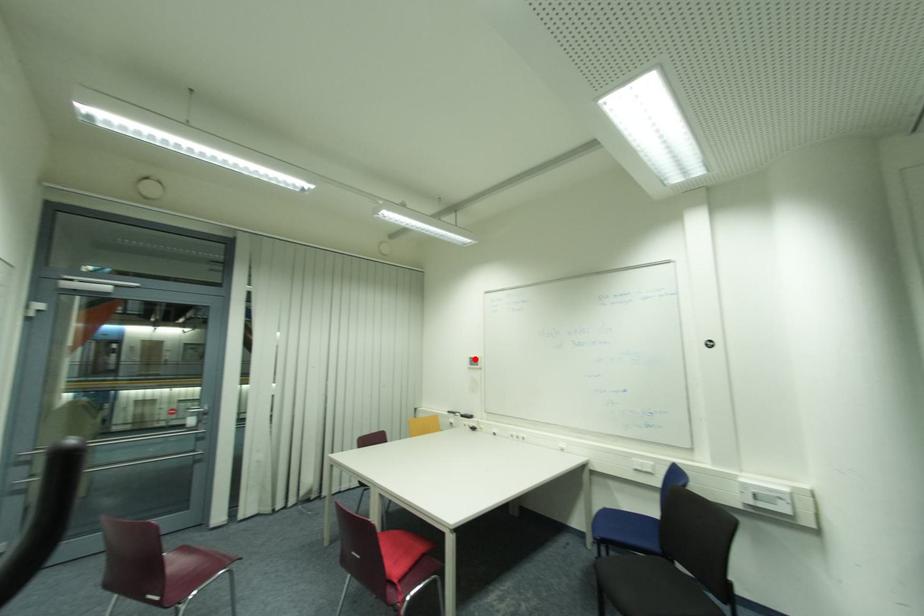
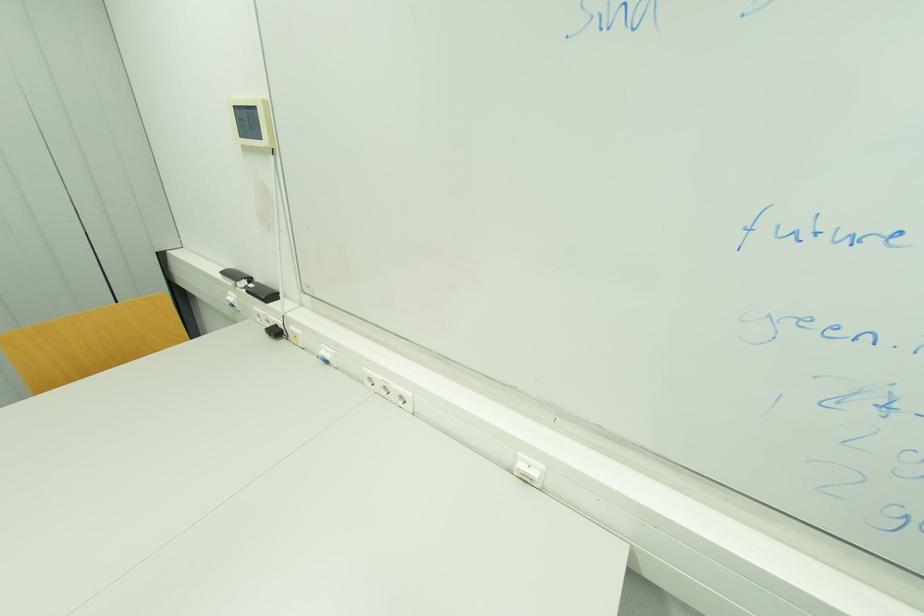
Where in the second image is the point corresponding to the highlighted location from the first image?

(237, 108)